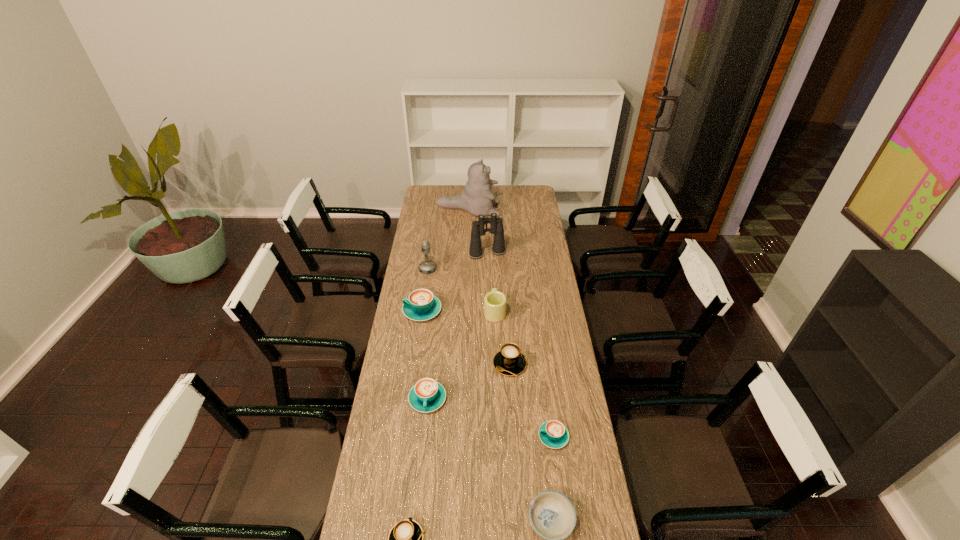
In order to click on vacant area situated 0.290m with the handle on the side of the fourth tallest object in this screenshot , I will do `click(493, 262)`.

At what (x,y) coordinates should I click in order to perform the action: click on vacant position located 0.260m with the handle on the side of the fourth tallest object. Please return your answer as a coordinate pair (x, y). This screenshot has height=540, width=960. Looking at the image, I should click on (493, 266).

I want to click on blank space located 0.280m on the left of the right black cappuccino, so click(x=424, y=364).

I want to click on free space located with the handle on the right side of the second smallest turquoise cappuccino, so click(415, 525).

I want to click on vacant space positioned 0.350m with the handle on the right side of the rightmost cappuccino, so click(x=441, y=436).

Locate an element on the screen. This screenshot has width=960, height=540. vacant area situated with the handle on the right side of the rightmost cappuccino is located at coordinates (463, 436).

Image resolution: width=960 pixels, height=540 pixels. In order to click on vacant space located with the handle on the right side of the rightmost cappuccino in this screenshot , I will do coord(466,436).

At what (x,y) coordinates should I click in order to perform the action: click on object present at the far edge. Please return your answer as a coordinate pair (x, y). The width and height of the screenshot is (960, 540). Looking at the image, I should click on (477, 199).

At what (x,y) coordinates should I click in order to perform the action: click on cat that is at the left edge. Please return your answer as a coordinate pair (x, y). The height and width of the screenshot is (540, 960). Looking at the image, I should click on (477, 199).

This screenshot has width=960, height=540. What are the coordinates of `microphone situated at the left edge` in the screenshot? It's located at (427, 266).